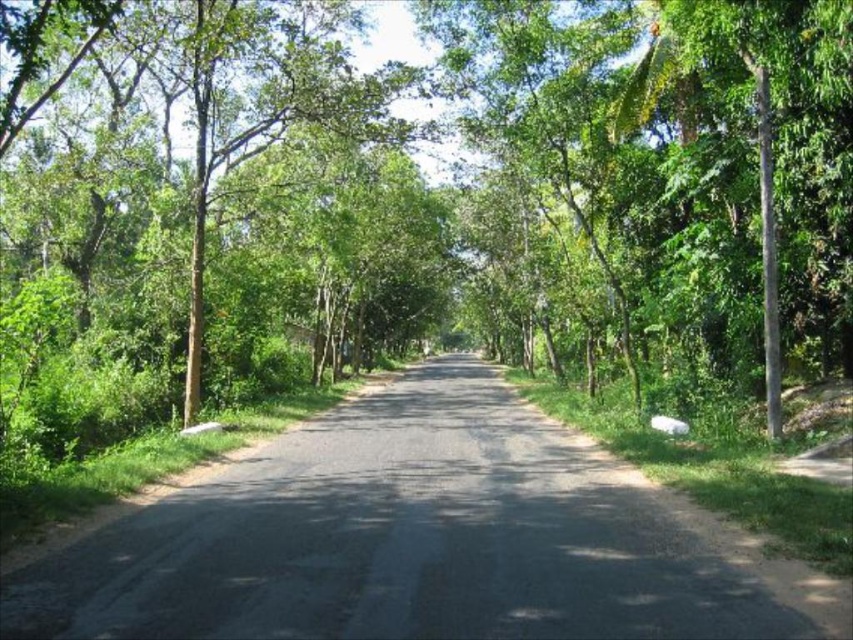
Does green leafy tree at center have a greater height compared to green leafy tree at left?

Yes.

Can you confirm if green leafy tree at center is thinner than green leafy tree at left?

In fact, green leafy tree at center might be wider than green leafy tree at left.

Is point (613, 147) positioned after point (62, 13)?

Yes, it is behind point (62, 13).

Locate an element on the screen. The image size is (853, 640). green leafy tree at center is located at coordinates [418, 198].

How distant is black asphalt road at center from green leafy tree at left?

253.67 feet

Who is more distant from viewer, [682,516] or [347,124]?

The point [347,124] is more distant.

Find the location of a particular element. This screenshot has width=853, height=640. black asphalt road at center is located at coordinates (422, 538).

Does green leafy tree at center have a lesser width compared to black asphalt road at center?

Incorrect, green leafy tree at center's width is not less than black asphalt road at center's.

Which is behind, point (405, 224) or point (473, 560)?

The point (405, 224) is more distant.

At what (x,y) coordinates should I click in order to perform the action: click on green leafy tree at center. Please return your answer as a coordinate pair (x, y). This screenshot has width=853, height=640. Looking at the image, I should click on (418, 198).

The width and height of the screenshot is (853, 640). Identify the location of green leafy tree at center. (418, 198).